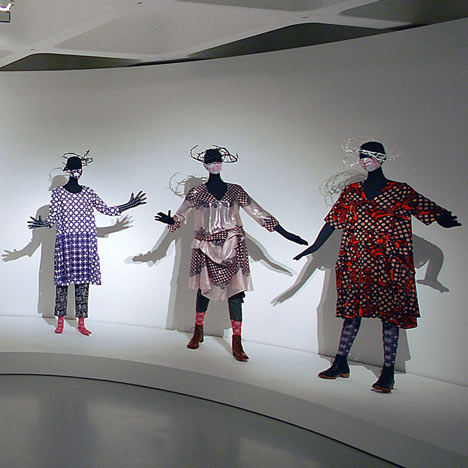
Image resolution: width=468 pixels, height=468 pixels. Find the location of `background wall`. background wall is located at coordinates (264, 106).